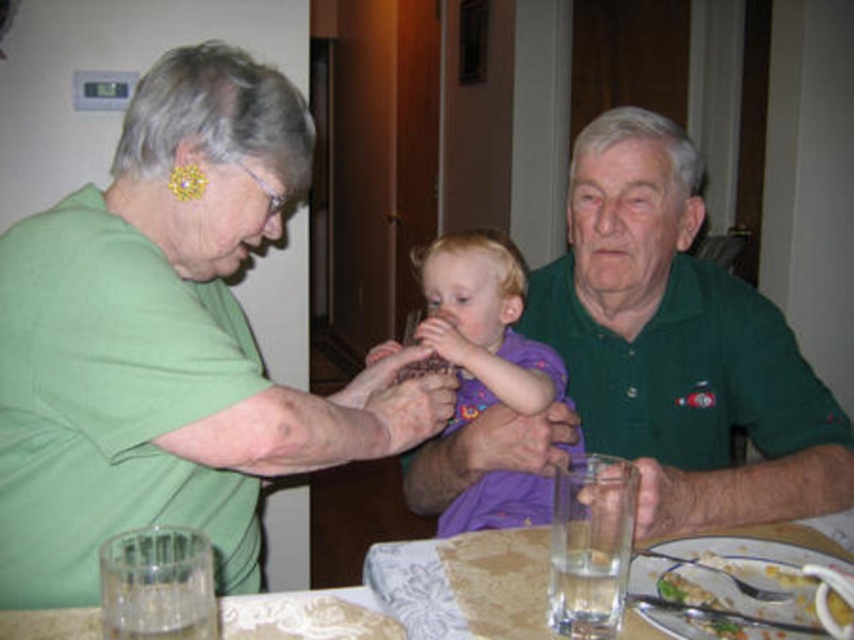
From the picture: You are standing 1.5 meters away from the dining table. If you want to reach the point at coordinates point (430, 506) on the table, will you have to move closer or farther away?

The point at coordinates point (430, 506) is 1.29 meters away from you. Since you are currently 1.5 meters away from the table, you need to move closer to reach it.

You are a photographer standing at the edge of the dining table. You want to take a photo of the green matte shirt at upper left without moving it. Can you adjust your position so that the camera is exactly 90 centimeters away from the shirt?

The green matte shirt at upper left and camera are 89.54 centimeters apart from each other. Since 89.54 cm is slightly less than 90 cm, you can move the camera back a tiny bit to reach the desired distance of exactly 90 centimeters.

You are a photographer standing at the camera position. You want to take a closeup of the green cotton shirt at center. Can you reach it without moving your feet? The camera has a zoom lens with a maximum zoom of 300mm.

The green cotton shirt at center is 36.77 inches away from the camera. With a 300mm zoom lens, you can likely capture a closeup without moving your feet, as the distance is within the effective range of the lens.